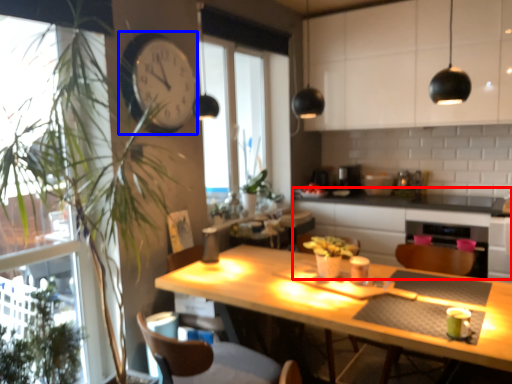
Question: Among these objects, which one is farthest to the camera, counter (highlighted by a red box) or clock (highlighted by a blue box)?

Choices:
 (A) counter
 (B) clock

Answer: (A)